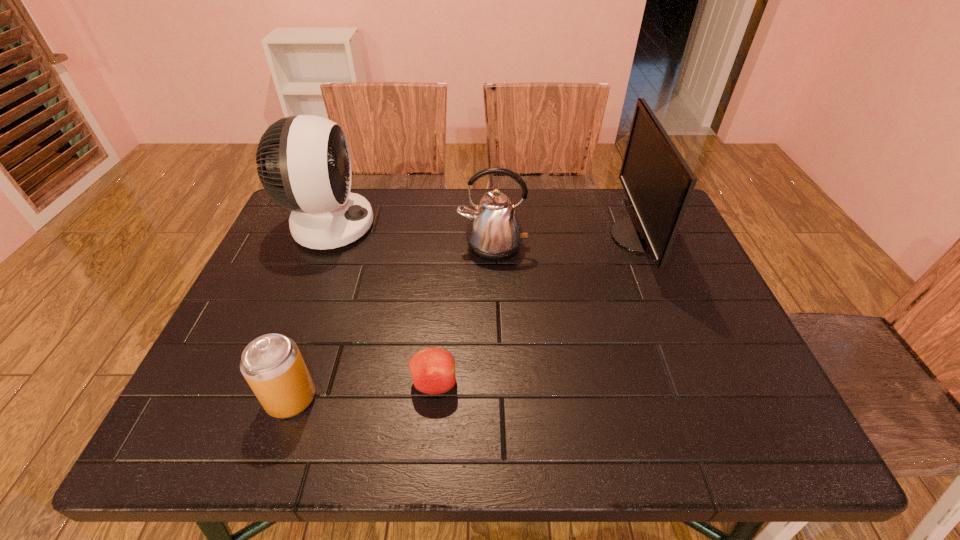
Locate an element on the screen. Image resolution: width=960 pixels, height=540 pixels. vacant space located 0.360m on the back of the fourth tallest object is located at coordinates (339, 261).

At what (x,y) coordinates should I click in order to perform the action: click on vacant space located on the back of the apple. Please return your answer as a coordinate pair (x, y). The height and width of the screenshot is (540, 960). Looking at the image, I should click on (445, 253).

At what (x,y) coordinates should I click in order to perform the action: click on fan positioned at the far edge. Please return your answer as a coordinate pair (x, y). The width and height of the screenshot is (960, 540). Looking at the image, I should click on (304, 164).

This screenshot has height=540, width=960. In order to click on monitor that is at the far edge in this screenshot , I will do `click(658, 183)`.

Find the location of a particular element. This screenshot has height=540, width=960. kettle present at the far edge is located at coordinates (494, 233).

You are a GUI agent. You are given a task and a screenshot of the screen. Output one action in this format:
    pyautogui.click(x=<x>, y=<y>)
    Task: Click on the object positioned at the near edge
    The image size is (960, 540).
    Given the screenshot: What is the action you would take?
    pyautogui.click(x=272, y=365)

Locate an element on the screen. fan that is at the left edge is located at coordinates point(304,164).

This screenshot has height=540, width=960. Identify the location of pop (soda) that is at the left edge. (272, 365).

In order to click on object that is positioned at the right edge in this screenshot , I will do `click(658, 183)`.

At what (x,y) coordinates should I click in order to perform the action: click on object situated at the far left corner. Please return your answer as a coordinate pair (x, y). This screenshot has height=540, width=960. Looking at the image, I should click on (304, 164).